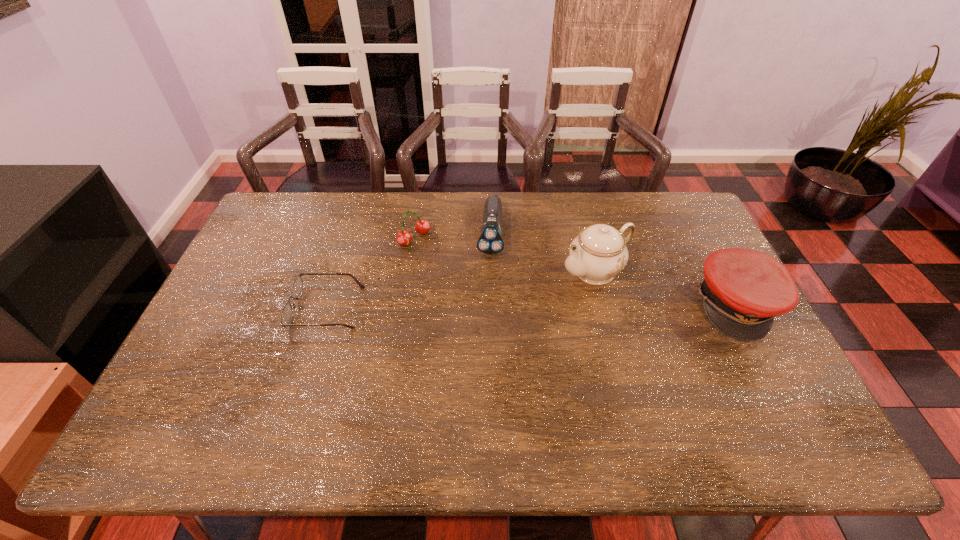
At what (x,y) coordinates should I click in order to perform the action: click on free space between the shortest object and the third object from right to left. Please return your answer as a coordinate pair (x, y). This screenshot has height=540, width=960. Looking at the image, I should click on (408, 271).

Identify the location of vacant point located between the fourth object from right to left and the leftmost object. The image size is (960, 540). (371, 273).

Find the location of a particular element. vacant space in between the tallest object and the fourth object from right to left is located at coordinates (505, 254).

Where is `empty space between the cap and the chinaware`? empty space between the cap and the chinaware is located at coordinates (666, 288).

The width and height of the screenshot is (960, 540). Identify the location of free space that is in between the fourth object from left to right and the shortest object. (461, 289).

I want to click on free space that is in between the rightmost object and the shortest object, so click(532, 306).

Locate which object ranks in proximity to the cap. Please provide its 2D coordinates. Your answer should be formatted as a tuple, i.e. [(x, y)], where the tuple contains the x and y coordinates of a point satisfying the conditions above.

[(599, 252)]

Identify which object is located as the second nearest to the tallest object. Please provide its 2D coordinates. Your answer should be formatted as a tuple, i.e. [(x, y)], where the tuple contains the x and y coordinates of a point satisfying the conditions above.

[(490, 242)]